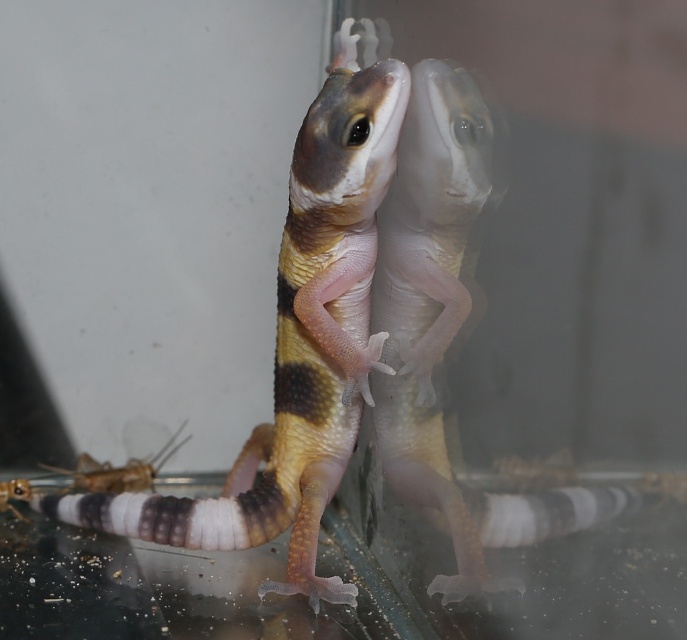
Question: Is multicolored scaly lizard at center positioned before brown matte cricket at lower left?

Choices:
 (A) no
 (B) yes

Answer: (B)

Question: Among these objects, which one is nearest to the camera?

Choices:
 (A) multicolored scaly lizard at center
 (B) brown matte cricket at lower left

Answer: (A)

Question: Can you confirm if multicolored scaly lizard at center is positioned to the left of brown matte cricket at lower left?

Choices:
 (A) no
 (B) yes

Answer: (A)

Question: Can you confirm if multicolored scaly lizard at center is wider than brown matte cricket at lower left?

Choices:
 (A) no
 (B) yes

Answer: (B)

Question: Among these objects, which one is farthest from the camera?

Choices:
 (A) multicolored scaly lizard at center
 (B) brown matte cricket at lower left

Answer: (B)